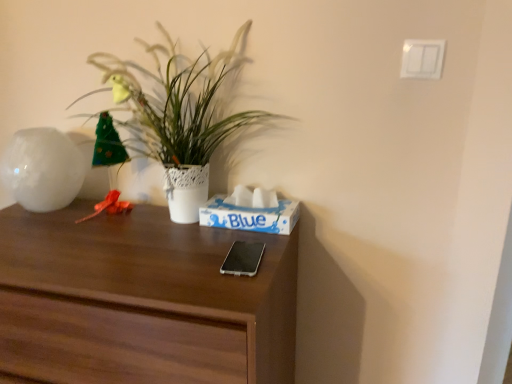
Find the location of a particular element. The width and height of the screenshot is (512, 384). vacant space positioned to the left of silver metallic phone at center is located at coordinates (168, 261).